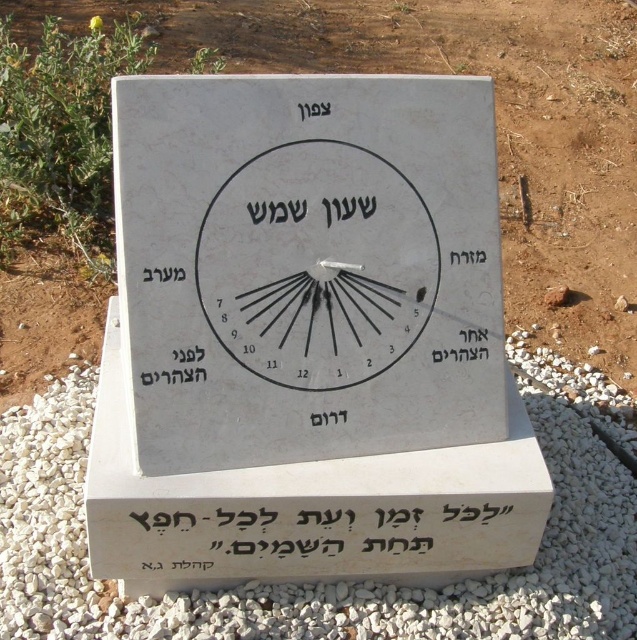
Can you confirm if white stone sundial at center is taller than white gravel at lower center?

Indeed, white stone sundial at center has a greater height compared to white gravel at lower center.

From the picture: Can you confirm if white stone sundial at center is smaller than white gravel at lower center?

Indeed, white stone sundial at center has a smaller size compared to white gravel at lower center.

Does point (354, 244) come closer to viewer compared to point (582, 616)?

Yes, it is.

Where is `white stone sundial at center`? The image size is (637, 640). white stone sundial at center is located at coordinates (306, 266).

Between white gravel at lower center and white stone clock at center, which one appears on the left side from the viewer's perspective?

white stone clock at center is more to the left.

Is white gravel at lower center below white stone clock at center?

Indeed, white gravel at lower center is positioned under white stone clock at center.

Based on the photo, who is more forward, (0, 458) or (408, 230)?

Point (408, 230)

At what (x,y) coordinates should I click in order to perform the action: click on white gravel at lower center. Please return your answer as a coordinate pair (x, y). Image resolution: width=637 pixels, height=640 pixels. Looking at the image, I should click on (338, 582).

Consider the image. Between brown soil at center and white gravel at lower center, which one appears on the left side from the viewer's perspective?

From the viewer's perspective, white gravel at lower center appears more on the left side.

Does brown soil at center have a greater width compared to white gravel at lower center?

Yes, brown soil at center is wider than white gravel at lower center.

Is point (0, 276) closer to viewer compared to point (554, 360)?

No, it is not.

What are the coordinates of `brown soil at center` in the screenshot? It's located at (496, 122).